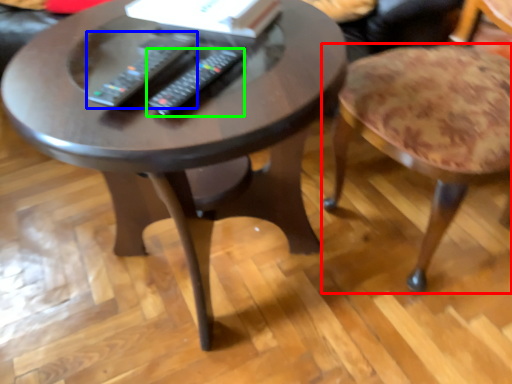
Question: Which object is the farthest from stool (highlighted by a red box)? Choose among these: remote (highlighted by a blue box) or remote (highlighted by a green box).

Choices:
 (A) remote
 (B) remote

Answer: (A)